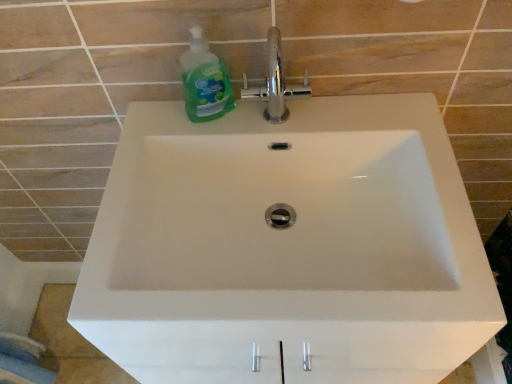
Question: Can you confirm if chrome metallic faucet at upper center is thinner than green translucent liquid soap at upper left?

Choices:
 (A) no
 (B) yes

Answer: (B)

Question: From a real-world perspective, is chrome metallic faucet at upper center on green translucent liquid soap at upper left?

Choices:
 (A) yes
 (B) no

Answer: (A)

Question: Considering the relative sizes of chrome metallic faucet at upper center and green translucent liquid soap at upper left in the image provided, is chrome metallic faucet at upper center wider than green translucent liquid soap at upper left?

Choices:
 (A) no
 (B) yes

Answer: (A)

Question: From the image's perspective, is chrome metallic faucet at upper center over green translucent liquid soap at upper left?

Choices:
 (A) yes
 (B) no

Answer: (A)

Question: Is chrome metallic faucet at upper center next to green translucent liquid soap at upper left?

Choices:
 (A) no
 (B) yes

Answer: (B)

Question: From the image's perspective, would you say chrome metallic faucet at upper center is shown under green translucent liquid soap at upper left?

Choices:
 (A) no
 (B) yes

Answer: (A)

Question: Would you say green translucent liquid soap at upper left is outside chrome metallic faucet at upper center?

Choices:
 (A) yes
 (B) no

Answer: (A)

Question: Is the depth of green translucent liquid soap at upper left less than that of chrome metallic faucet at upper center?

Choices:
 (A) yes
 (B) no

Answer: (A)

Question: Can you confirm if green translucent liquid soap at upper left is wider than chrome metallic faucet at upper center?

Choices:
 (A) yes
 (B) no

Answer: (A)

Question: Does green translucent liquid soap at upper left have a larger size compared to chrome metallic faucet at upper center?

Choices:
 (A) yes
 (B) no

Answer: (A)

Question: From the image's perspective, is green translucent liquid soap at upper left beneath chrome metallic faucet at upper center?

Choices:
 (A) no
 (B) yes

Answer: (B)

Question: From a real-world perspective, is green translucent liquid soap at upper left beneath chrome metallic faucet at upper center?

Choices:
 (A) yes
 (B) no

Answer: (A)

Question: Looking at their shapes, would you say green translucent liquid soap at upper left is wider or thinner than chrome metallic faucet at upper center?

Choices:
 (A) wide
 (B) thin

Answer: (A)